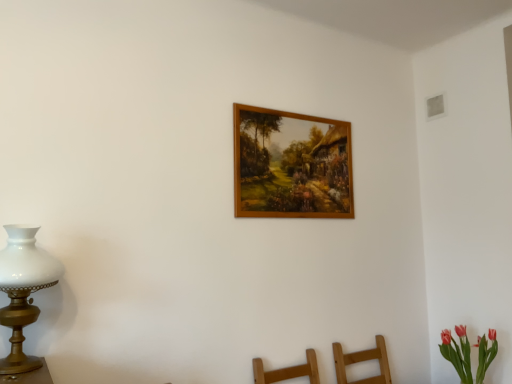
Question: Considering the positions of white glass lamp at left and wooden picture frame at upper center in the image, is white glass lamp at left taller or shorter than wooden picture frame at upper center?

Choices:
 (A) short
 (B) tall

Answer: (A)

Question: From the image's perspective, is white glass lamp at left positioned above or below wooden picture frame at upper center?

Choices:
 (A) above
 (B) below

Answer: (B)

Question: Which is farther from the white glass lamp at left?

Choices:
 (A) wooden picture frame at upper center
 (B) vivid pink petals at lower right

Answer: (B)

Question: Estimate the real-world distances between objects in this image. Which object is closer to the wooden picture frame at upper center?

Choices:
 (A) white glass lamp at left
 (B) vivid pink petals at lower right

Answer: (A)